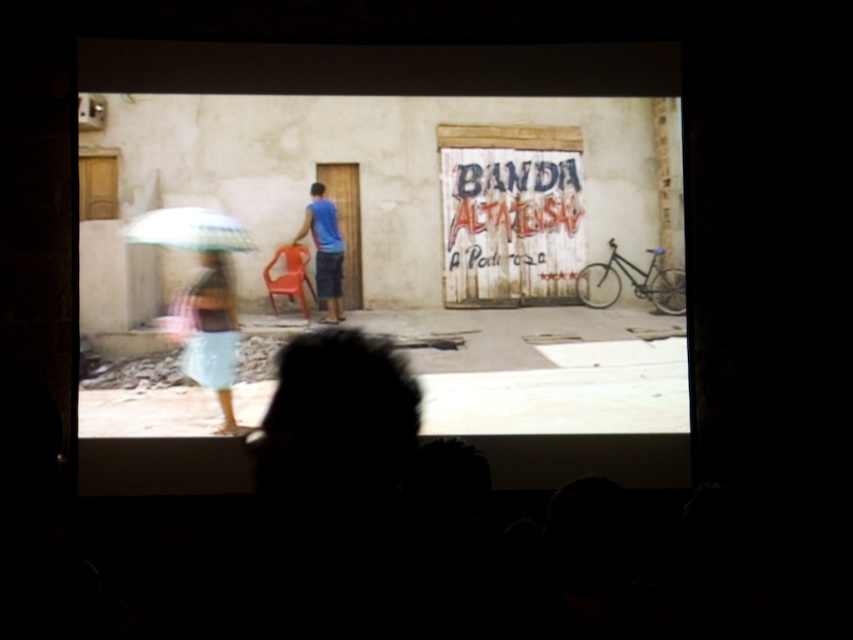
Who is more distant from viewer, (225, 278) or (308, 209)?

The point (308, 209) is more distant.

The height and width of the screenshot is (640, 853). I want to click on plaid fabric umbrella at left, so click(x=212, y=332).

Who is more distant from viewer, (184,300) or (157,218)?

Positioned behind is point (157,218).

Does point (227, 371) come farther from viewer compared to point (175, 224)?

No, it is in front of (175, 224).

Describe the element at coordinates (212, 332) in the screenshot. I see `plaid fabric umbrella at left` at that location.

This screenshot has height=640, width=853. What are the coordinates of `plaid fabric umbrella at left` in the screenshot? It's located at (212, 332).

Between point (236, 234) and point (335, 262), which one is positioned behind?

Point (335, 262)

Is translucent plastic umbrella at left shorter than blue matte shirt at center?

Yes, translucent plastic umbrella at left is shorter than blue matte shirt at center.

Who is more forward, (207,227) or (329,211)?

Point (207,227) is in front.

At what (x,y) coordinates should I click in order to perform the action: click on translucent plastic umbrella at left. Please return your answer as a coordinate pair (x, y). Looking at the image, I should click on click(x=189, y=228).